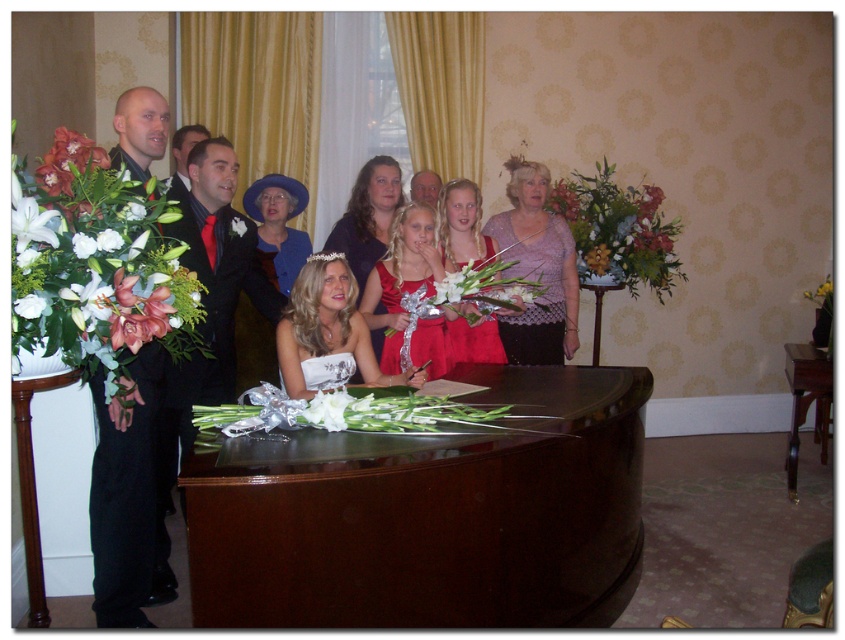
You are attending a wedding and notice a woman in a matte purple dress at center. Where exactly is she positioned in the room relative to the piano?

The matte purple dress at center is located at point (x=368, y=218), which means she is positioned slightly to the left and forward of the piano.

You are a guest at this event and need to place a small gift on the shiny dark wood table at center without covering the matte silver tiara at center. Is there enough space on the table for both items?

The shiny dark wood table at center is wider than the matte silver tiara at center, so there should be enough space to place the small gift on the table without covering the tiara.